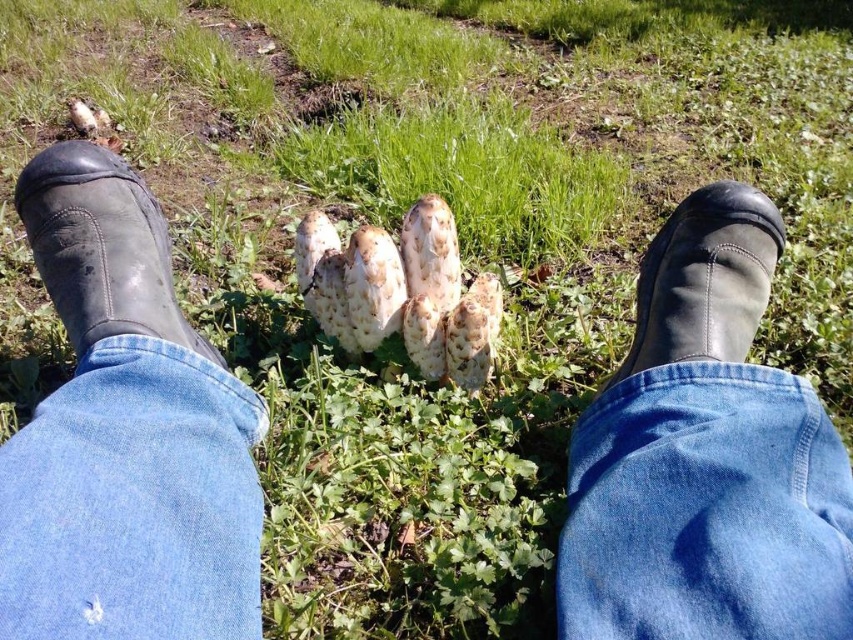
Consider the image. How much distance is there between black leather boot at left and black leather boot at center?

26.41 inches

Is black leather boot at left wider than black leather boot at center?

Yes, black leather boot at left is wider than black leather boot at center.

Is point (32, 211) closer to camera compared to point (689, 324)?

That is False.

This screenshot has width=853, height=640. Find the location of `black leather boot at left`. black leather boot at left is located at coordinates (102, 248).

Can you confirm if denim at lower left is smaller than black leather boot at center?

Yes.

Can you confirm if denim at lower left is positioned to the right of black leather boot at center?

In fact, denim at lower left is to the left of black leather boot at center.

Which is behind, point (242, 499) or point (735, 256)?

The point (735, 256) is more distant.

This screenshot has height=640, width=853. What are the coordinates of `denim at lower left` in the screenshot? It's located at (132, 502).

Who is higher up, denim at lower left or black leather boot at left?

black leather boot at left is above.

Is denim at lower left closer to the viewer compared to black leather boot at left?

Yes, it is.

Does point (222, 492) lie behind point (120, 259)?

No, it is in front of (120, 259).

Where is `denim at lower left`? The image size is (853, 640). denim at lower left is located at coordinates (132, 502).